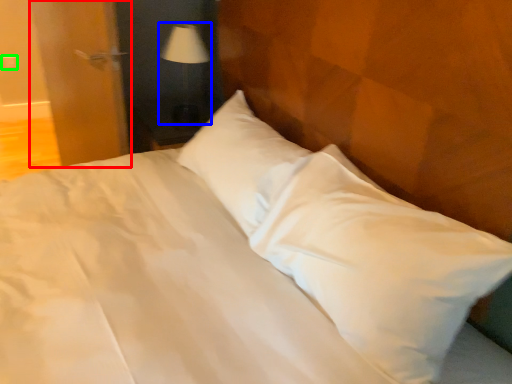
Question: Based on their relative distances, which object is nearer to door (highlighted by a red box)? Choose from table lamp (highlighted by a blue box) and electric outlet (highlighted by a green box).

Choices:
 (A) table lamp
 (B) electric outlet

Answer: (A)